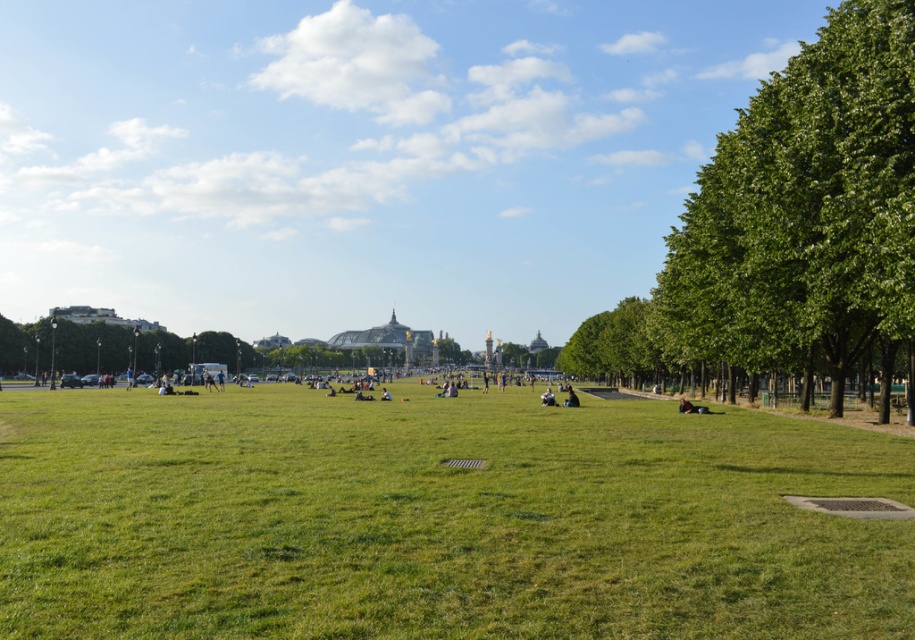
The width and height of the screenshot is (915, 640). I want to click on green grassy field at center, so click(x=438, y=518).

Is point (865, 612) farther from viewer compared to point (756, 198)?

No, (865, 612) is in front of (756, 198).

Locate an element on the screen. The height and width of the screenshot is (640, 915). green grassy field at center is located at coordinates (438, 518).